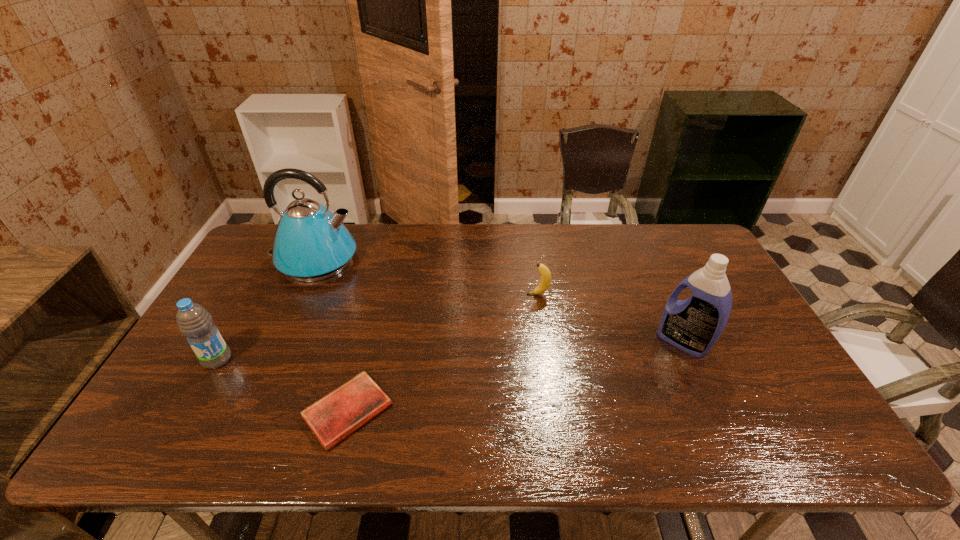
This screenshot has width=960, height=540. I want to click on unoccupied position between the farthest object and the water bottle, so click(266, 310).

The image size is (960, 540). I want to click on unoccupied position between the water bottle and the kettle, so click(266, 310).

Where is `blank region between the detergent and the kettle`? blank region between the detergent and the kettle is located at coordinates (499, 301).

Point out which object is positioned as the nearest to the nearest object. Please provide its 2D coordinates. Your answer should be formatted as a tuple, i.e. [(x, y)], where the tuple contains the x and y coordinates of a point satisfying the conditions above.

[(194, 322)]

Identify which object is the third nearest to the rightmost object. Please provide its 2D coordinates. Your answer should be formatted as a tuple, i.e. [(x, y)], where the tuple contains the x and y coordinates of a point satisfying the conditions above.

[(311, 243)]

Find the location of a particular element. This screenshot has height=540, width=960. free location that satisfies the following two spatial constraints: 1. from the stem of the second farthest object; 2. on the front side of the diary is located at coordinates (555, 411).

Locate an element on the screen. The width and height of the screenshot is (960, 540). vacant space that satisfies the following two spatial constraints: 1. on the back side of the rightmost object; 2. on the left side of the third tallest object is located at coordinates (228, 341).